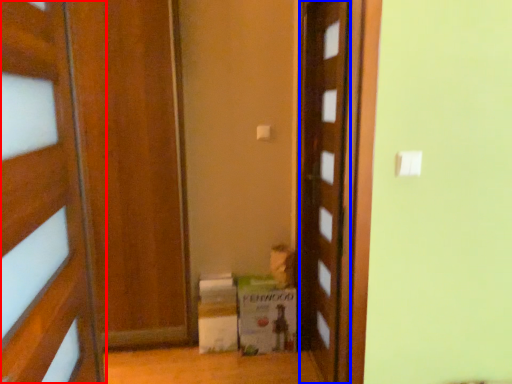
Question: Which point is further to the camera, door (highlighted by a red box) or door (highlighted by a blue box)?

Choices:
 (A) door
 (B) door

Answer: (B)